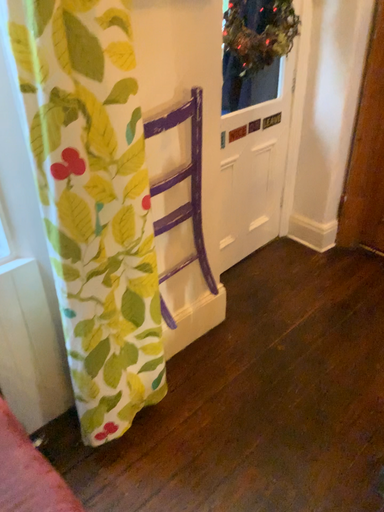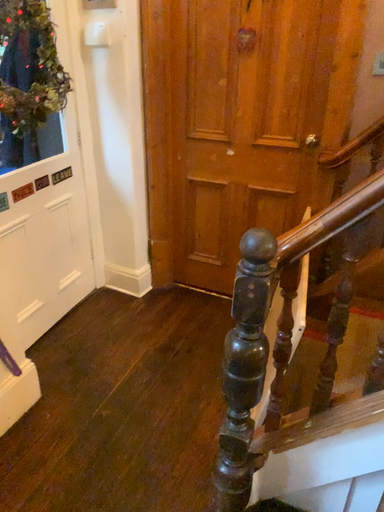
Question: How did the camera likely rotate when shooting the video?

Choices:
 (A) rotated downward
 (B) rotated upward

Answer: (B)